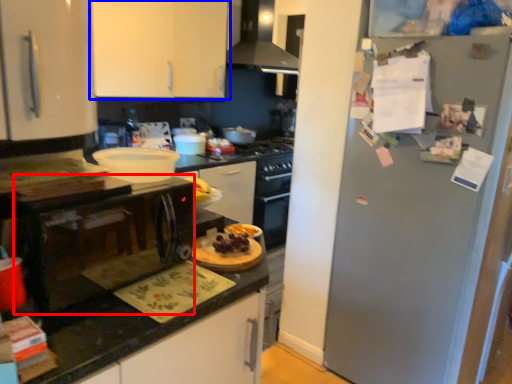
Question: Which object appears farthest to the camera in this image, microwave (highlighted by a red box) or cabinetry (highlighted by a blue box)?

Choices:
 (A) microwave
 (B) cabinetry

Answer: (B)